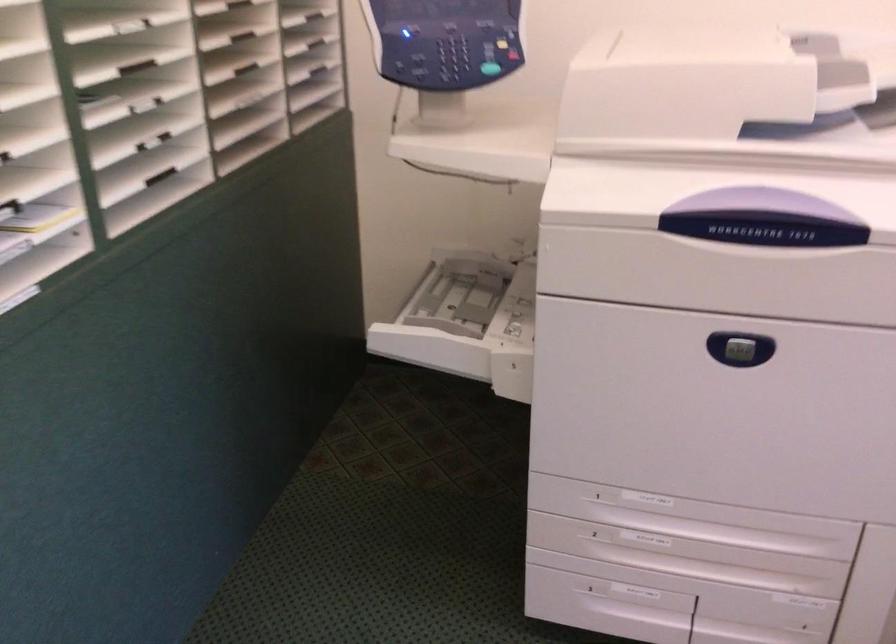
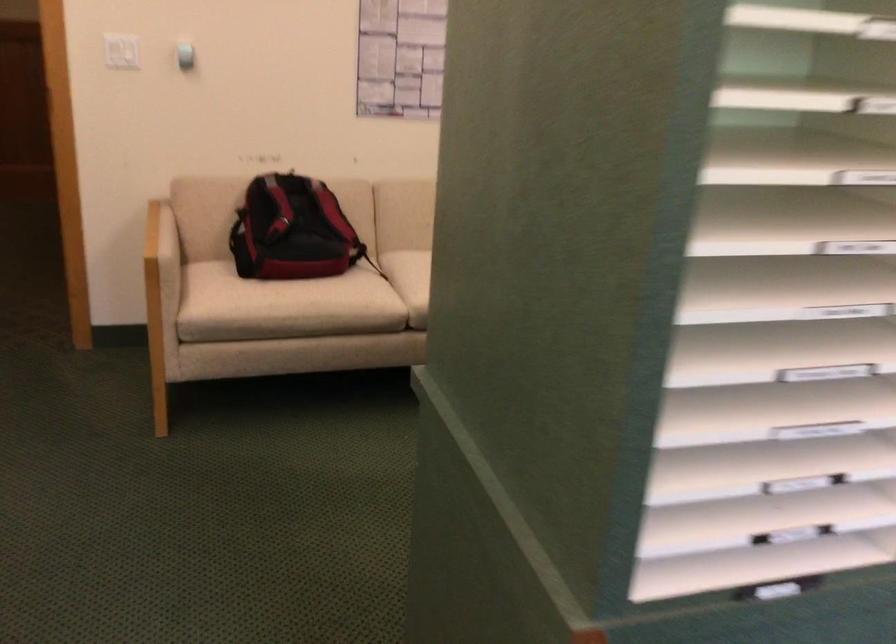
Question: The images are taken continuously from a first-person perspective. In which direction is your viewpoint rotating?

Choices:
 (A) Left
 (B) Right
 (C) Up
 (D) Down

Answer: (A)